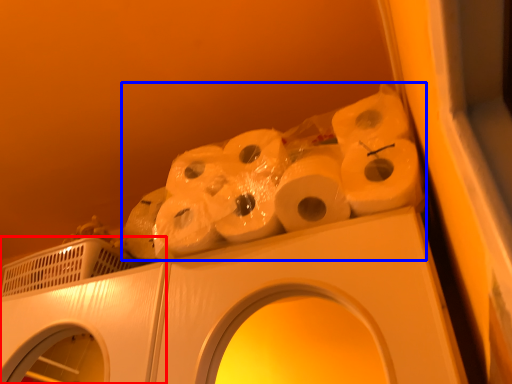
Question: Among these objects, which one is farthest to the camera, washing machine (highlighted by a red box) or toilet paper (highlighted by a blue box)?

Choices:
 (A) washing machine
 (B) toilet paper

Answer: (A)